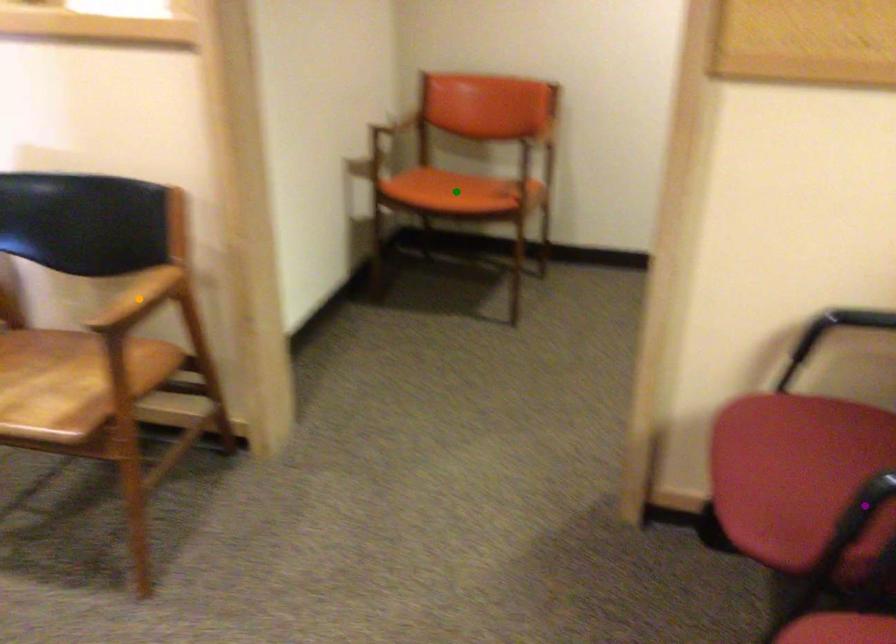
In the scene shown: Order these from nearest to farthest:
green point, orange point, purple point

purple point < orange point < green point